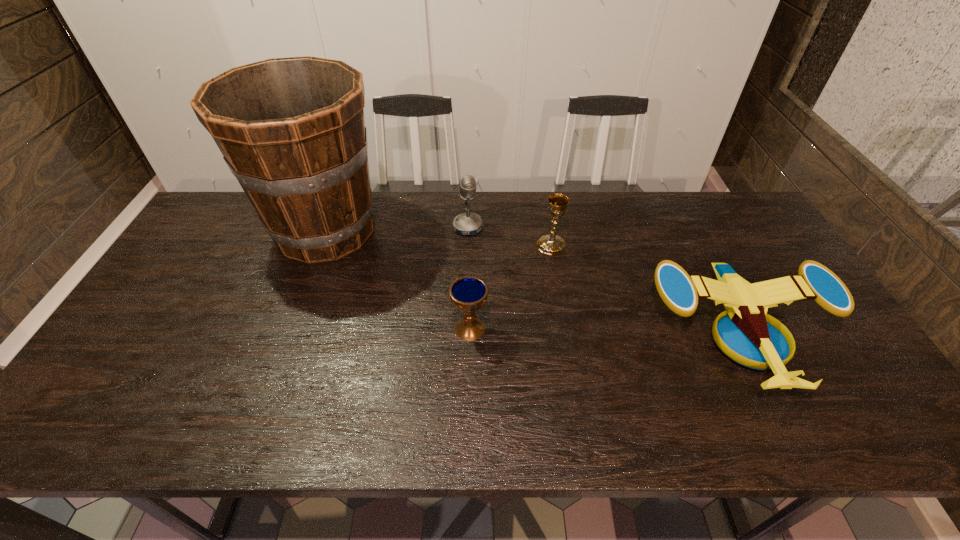
Locate an element on the screen. The image size is (960, 540). free region located 0.080m on the right of the farther chalice is located at coordinates (592, 245).

This screenshot has height=540, width=960. What are the coordinates of `vacant area situated 0.320m on the left of the shorter chalice` in the screenshot? It's located at (329, 328).

This screenshot has height=540, width=960. In order to click on bucket that is positioned at the far edge in this screenshot , I will do `click(292, 131)`.

Locate an element on the screen. Image resolution: width=960 pixels, height=540 pixels. microphone that is at the far edge is located at coordinates (468, 223).

I want to click on chalice at the far edge, so click(x=551, y=244).

The height and width of the screenshot is (540, 960). Find the location of `object that is at the near edge`. object that is at the near edge is located at coordinates (749, 336).

Identify the location of object that is at the right edge. The width and height of the screenshot is (960, 540). (749, 336).

Locate an element on the screen. object that is at the near right corner is located at coordinates (749, 336).

In the image, there is a desktop. What are the coordinates of `vacant space at the far edge` in the screenshot? It's located at (450, 193).

Locate an element on the screen. The width and height of the screenshot is (960, 540). free space at the left edge is located at coordinates (172, 323).